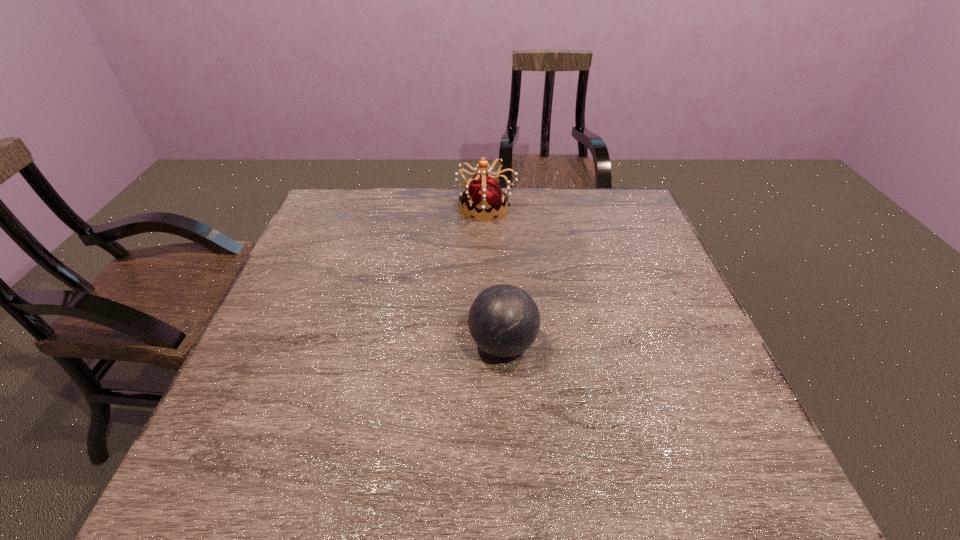
Identify the location of the farther object. (483, 196).

This screenshot has height=540, width=960. In order to click on tiara in this screenshot , I will do [x=483, y=196].

You are a GUI agent. You are given a task and a screenshot of the screen. Output one action in this format:
    pyautogui.click(x=<x>, y=<y>)
    Task: Click on the bowling ball
    
    Given the screenshot: What is the action you would take?
    pyautogui.click(x=504, y=320)

Where is `the shorter object`? the shorter object is located at coordinates (504, 320).

Image resolution: width=960 pixels, height=540 pixels. What are the coordinates of `blank space located 0.130m on the front-facing side of the tiara` in the screenshot? It's located at (417, 207).

You are a GUI agent. You are given a task and a screenshot of the screen. Output one action in this format:
    pyautogui.click(x=<x>, y=<y>)
    Task: Click on the vacant space located 0.370m on the front-facing side of the tiara
    Image resolution: width=960 pixels, height=540 pixels.
    Given the screenshot: What is the action you would take?
    pyautogui.click(x=342, y=207)

The width and height of the screenshot is (960, 540). What are the coordinates of `free spot located 0.330m on the front-facing side of the tiara` in the screenshot? It's located at (354, 207).

I want to click on blank space located on the grip area of the shorter object, so click(315, 344).

Find the location of a particular element. blank space located on the grip area of the shorter object is located at coordinates (446, 344).

I want to click on vacant space located on the grip area of the shorter object, so click(x=363, y=344).